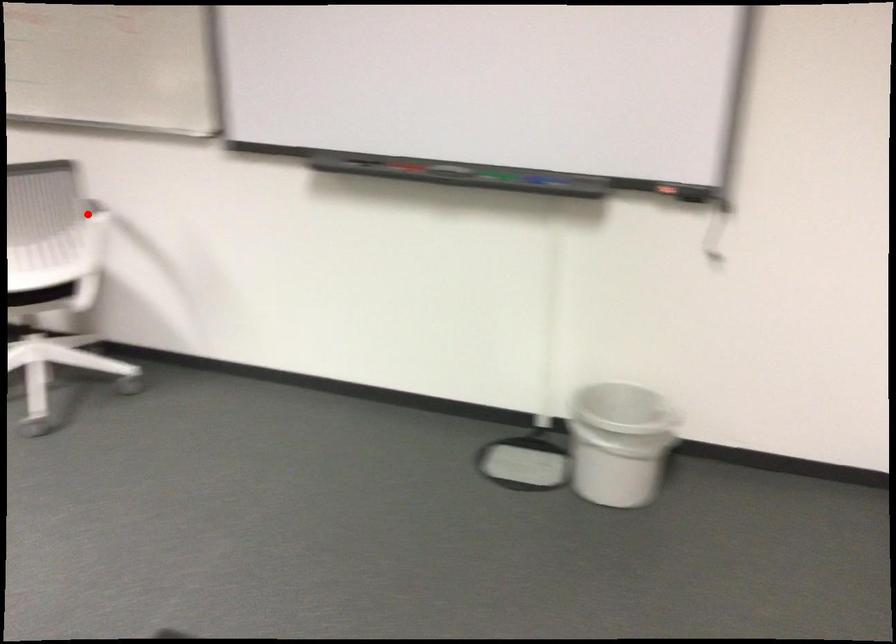
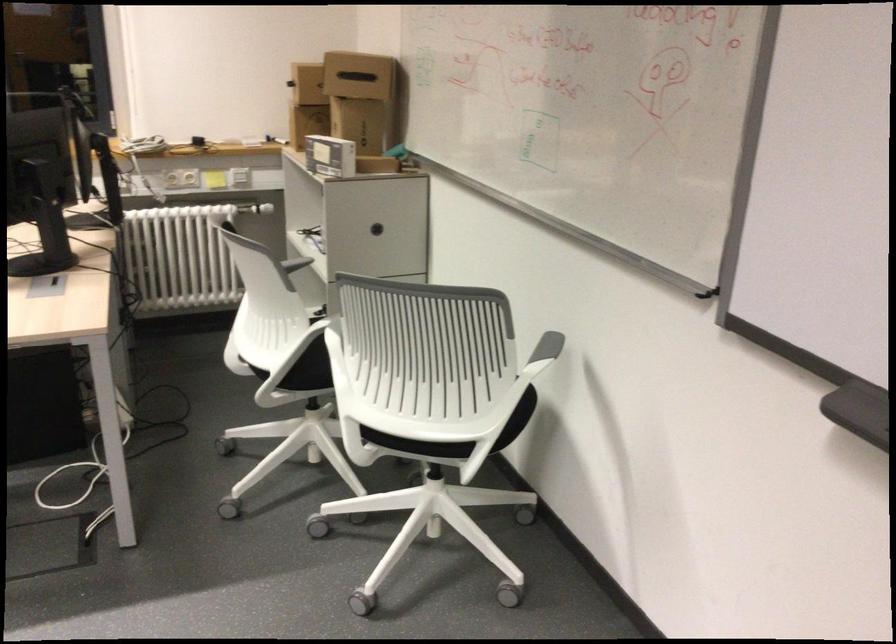
Question: I am providing you with two images of the same scene from different viewpoints. In image1, a red point is highlighted. Considering the same 3D point in image2, which of the following is correct?

Choices:
 (A) It is closer
 (B) It is farther

Answer: (A)